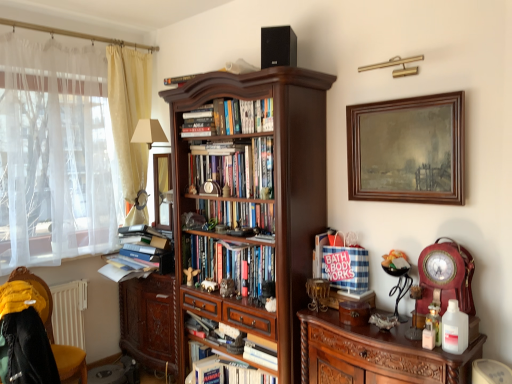
This screenshot has width=512, height=384. Identify the location of vacant region to the left of transparent plastic bottle at right. (415, 345).